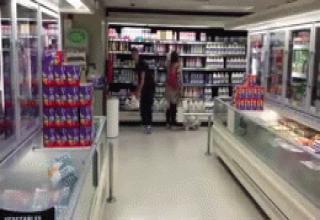
You are a GUI agent. You are given a task and a screenshot of the screen. Output one action in this format:
    pyautogui.click(x=<x>, y=<y>)
    Task: Click on the white floor
    Image resolution: width=320 pixels, height=220 pixels.
    Given the screenshot: What is the action you would take?
    pyautogui.click(x=202, y=186)